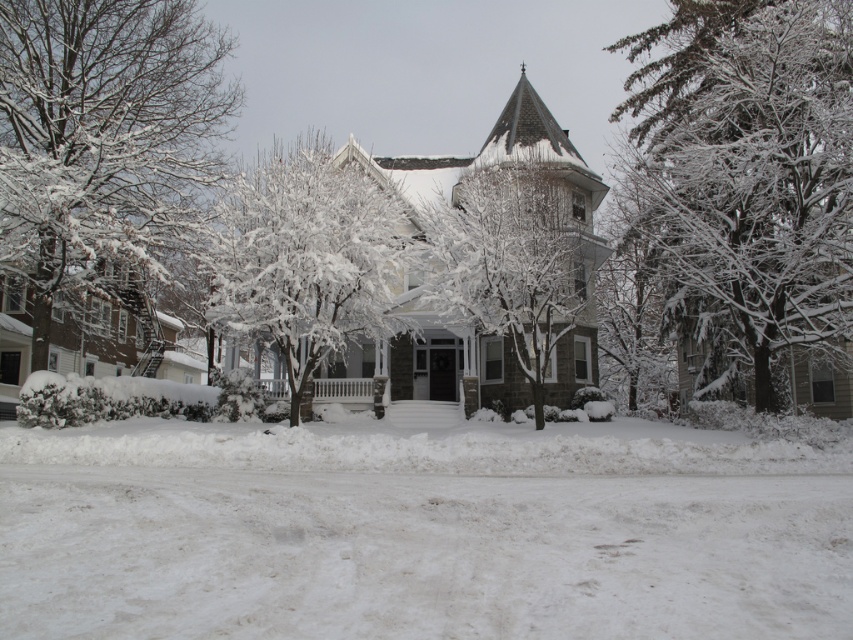
Which is more to the left, white snow-covered tree at left or white snow-covered tree at center?

white snow-covered tree at left

Does white snow-covered tree at left have a smaller size compared to white snow-covered tree at center?

Indeed, white snow-covered tree at left has a smaller size compared to white snow-covered tree at center.

Which is behind, point (122, 205) or point (384, 308)?

The point (384, 308) is behind.

Find the location of a particular element. This screenshot has height=640, width=853. white snow-covered tree at left is located at coordinates (103, 141).

In the scene shown: Can you confirm if white snow-covered tree at center is shorter than snow-covered tree at center?

No, white snow-covered tree at center is not shorter than snow-covered tree at center.

Does white snow-covered tree at center appear over snow-covered tree at center?

Indeed, white snow-covered tree at center is positioned over snow-covered tree at center.

Which is behind, point (335, 205) or point (509, 323)?

Positioned behind is point (509, 323).

Identify the location of white snow-covered tree at center. (306, 259).

Image resolution: width=853 pixels, height=640 pixels. What do you see at coordinates (421, 532) in the screenshot?
I see `white fluffy snow at center` at bounding box center [421, 532].

Is point (286, 536) closer to camera compared to point (518, 262)?

Yes, it is in front of point (518, 262).

Which is in front, point (577, 618) or point (468, 324)?

Point (577, 618) is in front.

Locate an element on the screen. white fluffy snow at center is located at coordinates (421, 532).